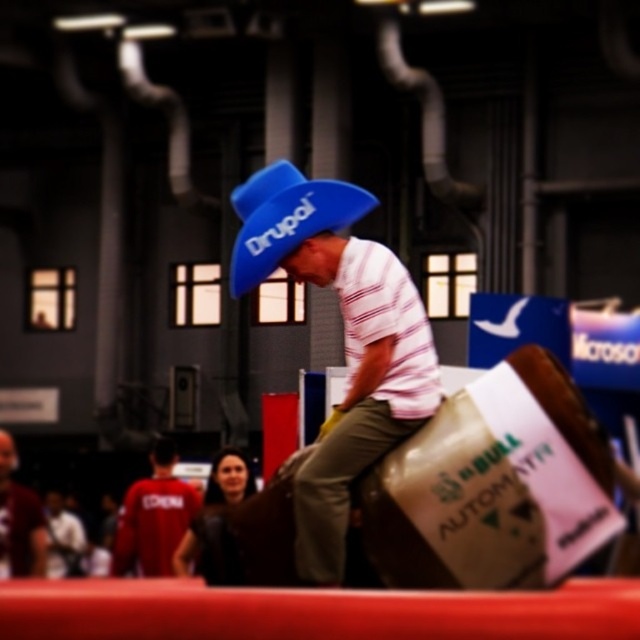
Does matte blue hat at center have a smaller size compared to red fabric shirt at lower left?

Correct, matte blue hat at center occupies less space than red fabric shirt at lower left.

Can you confirm if matte blue hat at center is positioned below red fabric shirt at lower left?

No, matte blue hat at center is not below red fabric shirt at lower left.

Is point (253, 220) more distant than point (129, 490)?

No, (253, 220) is closer to viewer.

What are the coordinates of `matte blue hat at center` in the screenshot? It's located at (344, 340).

Is red fabric shirt at lower left smaller than matte red shirt at left?

Indeed, red fabric shirt at lower left has a smaller size compared to matte red shirt at left.

Can you confirm if red fabric shirt at lower left is shorter than matte red shirt at left?

Incorrect, red fabric shirt at lower left's height does not fall short of matte red shirt at left's.

Between point (163, 452) and point (33, 506), which one is positioned behind?

The point (163, 452) is more distant.

Where is `red fabric shirt at lower left`? red fabric shirt at lower left is located at coordinates (154, 515).

Can you confirm if matte blue hat at center is positioned to the left of matte red shirt at left?

Incorrect, matte blue hat at center is not on the left side of matte red shirt at left.

Between point (406, 339) and point (33, 506), which one is positioned behind?

The point (33, 506) is behind.

Identify the location of matte blue hat at center. (344, 340).